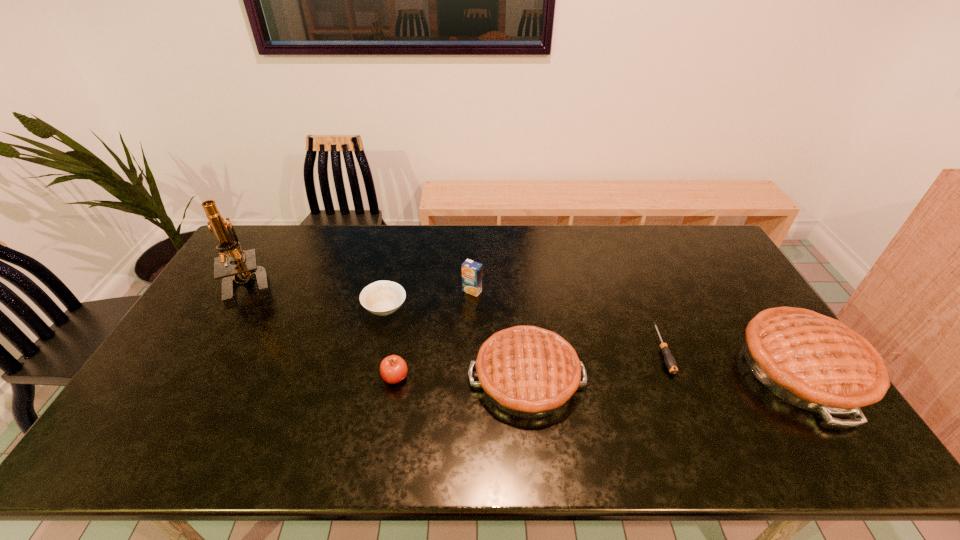
Identify the location of vacant space that's between the orange_juice and the taller pie. (637, 330).

Where is `free space between the tallest object and the screwdriver`? The height and width of the screenshot is (540, 960). free space between the tallest object and the screwdriver is located at coordinates (456, 316).

Find the location of a particular element. free space between the leftmost object and the shorter pie is located at coordinates (389, 330).

Find the location of a particular element. The image size is (960, 540). free space that is in between the fifth tallest object and the bowl is located at coordinates (391, 343).

Identify the location of vacant space that's between the second shortest object and the shorter pie. The height and width of the screenshot is (540, 960). (456, 343).

Where is `free space between the shorter pie and the leftmost object`? free space between the shorter pie and the leftmost object is located at coordinates tap(389, 330).

Image resolution: width=960 pixels, height=540 pixels. Identify the location of the closest object to the shorter pie. (393, 369).

Identify which object is the sixth nearest to the leftmost object. Please provide its 2D coordinates. Your answer should be formatted as a tuple, i.e. [(x, y)], where the tuple contains the x and y coordinates of a point satisfying the conditions above.

[(814, 362)]

The width and height of the screenshot is (960, 540). What are the coordinates of `free space that satisfies the following two spatial constraints: 1. on the back side of the sixth shortest object; 2. on the right side of the shorter pie` in the screenshot? It's located at (526, 369).

Locate an element on the screen. Image resolution: width=960 pixels, height=540 pixels. free region that satisfies the following two spatial constraints: 1. on the back side of the apple; 2. on the right side of the second object from right to left is located at coordinates (400, 350).